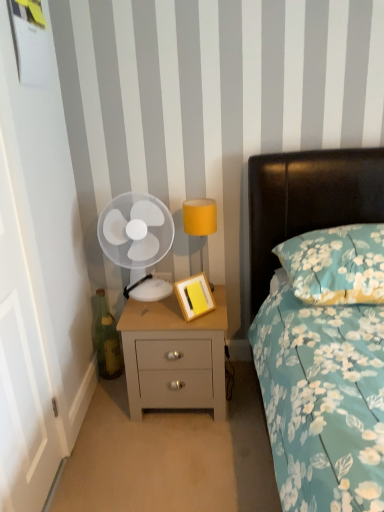
Question: Can you confirm if floral fabric pillow at upper right is shorter than white plastic fan at left?

Choices:
 (A) no
 (B) yes

Answer: (B)

Question: Is floral fabric pillow at upper right to the right of white plastic fan at left from the viewer's perspective?

Choices:
 (A) yes
 (B) no

Answer: (A)

Question: From a real-world perspective, is floral fabric pillow at upper right located higher than white plastic fan at left?

Choices:
 (A) no
 (B) yes

Answer: (A)

Question: Is floral fabric pillow at upper right closer to the viewer compared to white plastic fan at left?

Choices:
 (A) no
 (B) yes

Answer: (B)

Question: Does floral fabric pillow at upper right have a smaller size compared to white plastic fan at left?

Choices:
 (A) no
 (B) yes

Answer: (A)

Question: Considering the positions of yellow fabric lampshade at upper right and green glass bottle at lower left in the image, is yellow fabric lampshade at upper right bigger or smaller than green glass bottle at lower left?

Choices:
 (A) small
 (B) big

Answer: (B)

Question: Is yellow fabric lampshade at upper right spatially inside green glass bottle at lower left, or outside of it?

Choices:
 (A) outside
 (B) inside

Answer: (A)

Question: Considering the positions of yellow fabric lampshade at upper right and green glass bottle at lower left in the image, is yellow fabric lampshade at upper right taller or shorter than green glass bottle at lower left?

Choices:
 (A) tall
 (B) short

Answer: (B)

Question: From the image's perspective, relative to green glass bottle at lower left, is yellow fabric lampshade at upper right above or below?

Choices:
 (A) above
 (B) below

Answer: (A)

Question: Considering the positions of light gray wood nightstand at center and yellow fabric lampshade at upper right in the image, is light gray wood nightstand at center wider or thinner than yellow fabric lampshade at upper right?

Choices:
 (A) wide
 (B) thin

Answer: (A)

Question: Is point (127, 386) positioned closer to the camera than point (200, 212)?

Choices:
 (A) closer
 (B) farther

Answer: (B)

Question: Considering their positions, is light gray wood nightstand at center located in front of or behind yellow fabric lampshade at upper right?

Choices:
 (A) behind
 (B) front

Answer: (B)

Question: Is light gray wood nightstand at center bigger or smaller than yellow fabric lampshade at upper right?

Choices:
 (A) small
 (B) big

Answer: (B)

Question: Is point (97, 348) positioned closer to the camera than point (135, 307)?

Choices:
 (A) closer
 (B) farther

Answer: (B)

Question: In the image, is green glass bottle at lower left positioned in front of or behind light gray wood nightstand at center?

Choices:
 (A) front
 (B) behind

Answer: (B)